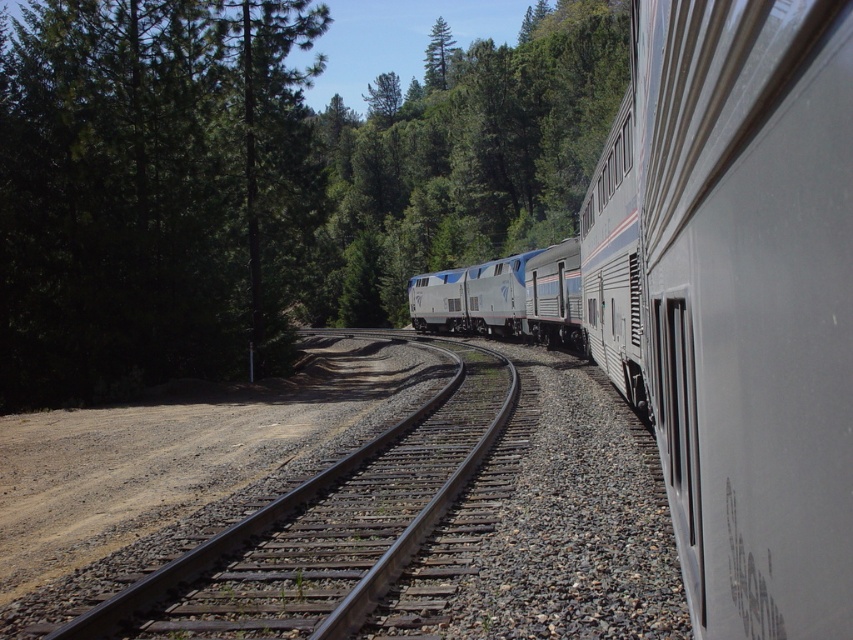
You are a passenger sitting in the train and looking out the window. You notice a green leafy tree at upper left and a silver metallic train at center. Which object appears taller in the scene?

The green leafy tree at upper left appears taller than the silver metallic train at center in the scene.

You are standing at the point labeled point (340, 541) and want to walk to the point labeled point (769, 195). Given the railway track in the scene, which direction should you move relative to the track to reach your destination?

Since point (769, 195) is in front of point (340, 541), you should move forward along the railway track towards the direction the train is heading to reach your destination.

You are standing on the passenger train with a 20 meter long platform behind you. You look out the window and see the green leafy tree at upper left. Can you reach the tree by walking backward on the platform?

The green leafy tree at upper left is 21.00 meters away from the viewer. Since the platform is only 20 meters long, you cannot reach the tree by walking backward on the platform.